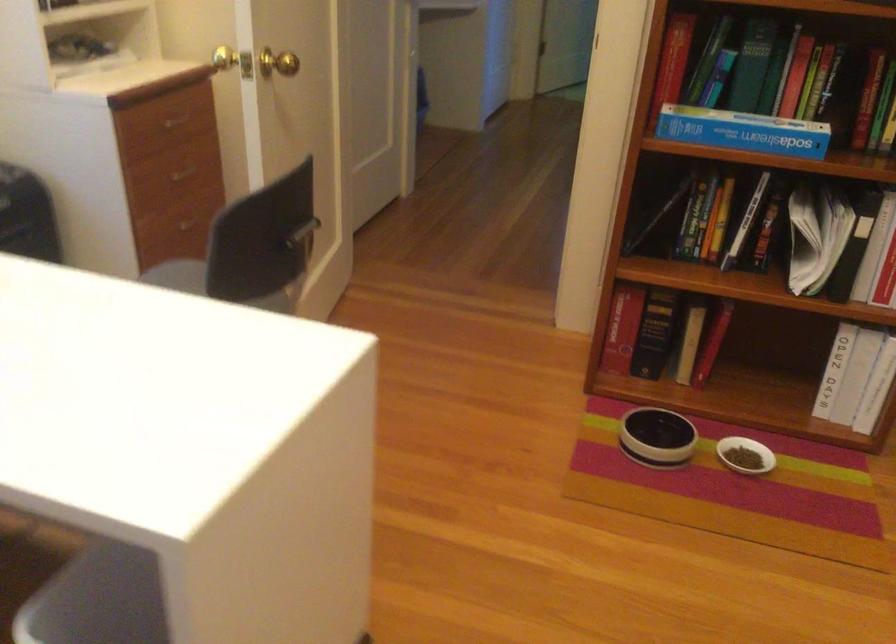
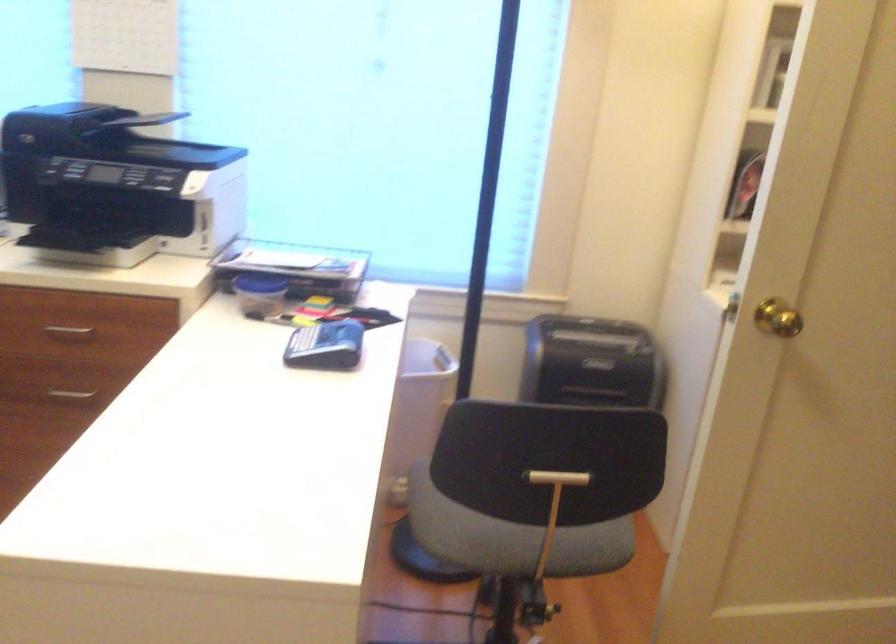
Where in the second image is the point corresponding to [278,270] from the first image?

(535, 495)